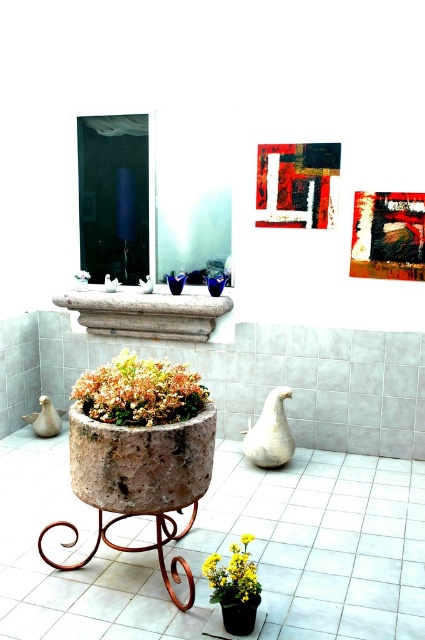
Question: Which object is closer to the camera taking this photo?

Choices:
 (A) yellow matte flower at lower center
 (B) matte stone pot at center

Answer: (A)

Question: Which of the following is the closest to the observer?

Choices:
 (A) matte black pot at lower center
 (B) yellow matte flower at lower center

Answer: (B)

Question: Among these points, which one is farthest from the camera?

Choices:
 (A) (246, 604)
 (B) (229, 595)
 (C) (192, 410)

Answer: (C)

Question: Is yellow matte flower at lower center bigger than matte black pot at lower center?

Choices:
 (A) yes
 (B) no

Answer: (A)

Question: Considering the relative positions of matte stone pot at center and yellow matte flower at lower center in the image provided, where is matte stone pot at center located with respect to yellow matte flower at lower center?

Choices:
 (A) above
 (B) below

Answer: (A)

Question: Is matte stone pot at center to the right of yellow matte flower at lower center from the viewer's perspective?

Choices:
 (A) no
 (B) yes

Answer: (A)